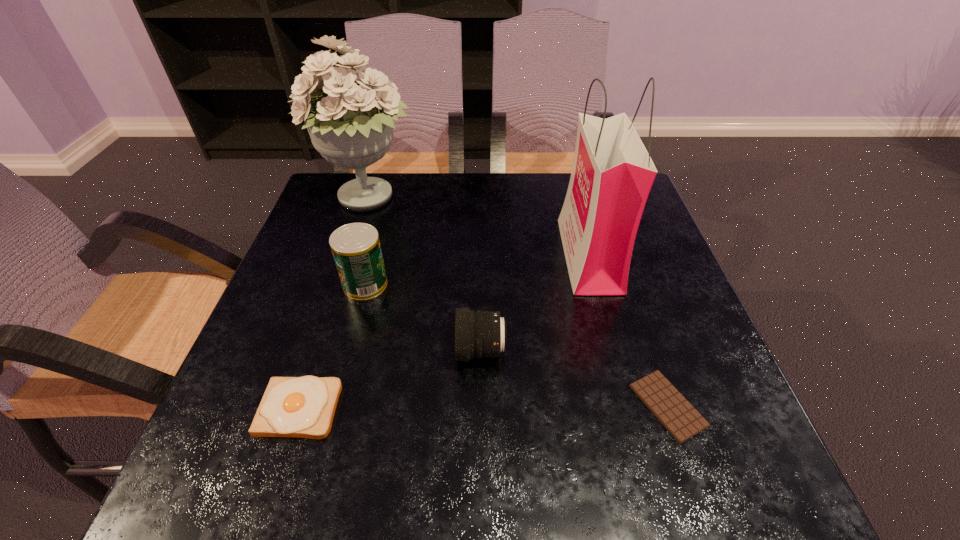
Locate an element on the screen. bouquet that is positioned at the left edge is located at coordinates (351, 126).

Locate an element on the screen. can that is at the left edge is located at coordinates (356, 249).

I want to click on toast located in the left edge section of the desktop, so click(304, 407).

What are the coordinates of `shopping bag situated at the right edge` in the screenshot? It's located at (612, 174).

Image resolution: width=960 pixels, height=540 pixels. I want to click on chocolate bar at the right edge, so coord(676,414).

The image size is (960, 540). In order to click on object present at the far left corner in this screenshot , I will do `click(351, 126)`.

Identify the location of object situated at the far right corner. (612, 174).

What are the coordinates of `object that is at the near right corner` in the screenshot? It's located at (676, 414).

Where is `vacant space at the far edge of the desktop`? This screenshot has width=960, height=540. vacant space at the far edge of the desktop is located at coordinates (431, 192).

This screenshot has height=540, width=960. In the image, there is a desktop. In order to click on vacant space at the near edge in this screenshot , I will do `click(400, 463)`.